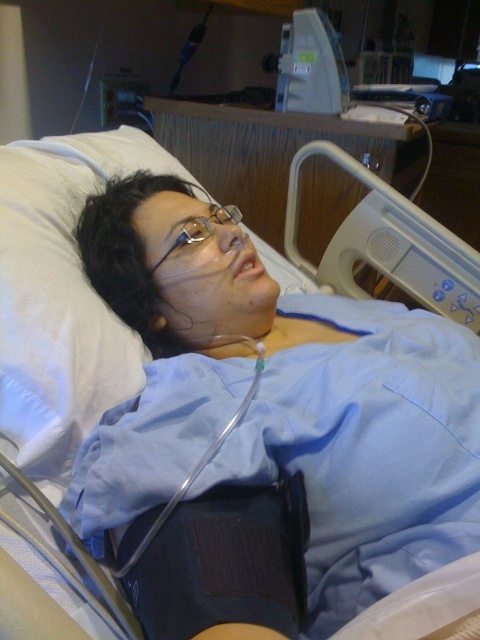
How much distance is there between gray plastic monitor at upper center and clear plastic glasses at center?

gray plastic monitor at upper center is 31.19 inches away from clear plastic glasses at center.

Is gray plastic monitor at upper center further to the viewer compared to clear plastic glasses at center?

Yes, it is.

Locate an element on the screen. gray plastic monitor at upper center is located at coordinates (x=311, y=65).

Is point (327, 147) behind point (186, 221)?

Yes.

The image size is (480, 640). What do you see at coordinates (387, 244) in the screenshot?
I see `white plastic hospital bed rail at upper right` at bounding box center [387, 244].

Where is `white plastic hospital bed rail at upper right`? The width and height of the screenshot is (480, 640). white plastic hospital bed rail at upper right is located at coordinates (387, 244).

Consider the image. Between white soft pillow at upper left and white plastic hospital bed rail at upper right, which one has less height?

Standing shorter between the two is white plastic hospital bed rail at upper right.

Between point (83, 417) and point (470, 314), which one is positioned behind?

The point (470, 314) is behind.

This screenshot has width=480, height=640. In order to click on white soft pillow at upper left in this screenshot , I will do `click(60, 294)`.